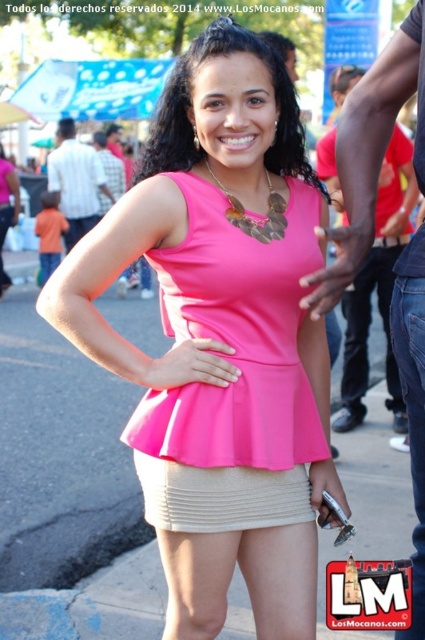
Question: Is pink matte peplum top at center closer to camera compared to beige ribbed miniskirt at center?

Choices:
 (A) yes
 (B) no

Answer: (A)

Question: Estimate the real-world distances between objects in this image. Which object is farther from the beige ribbed miniskirt at center?

Choices:
 (A) pink matte top at center
 (B) pink matte peplum top at center

Answer: (B)

Question: Does pink matte top at center lie in front of pink matte peplum top at center?

Choices:
 (A) no
 (B) yes

Answer: (B)

Question: Which object is closer to the camera taking this photo?

Choices:
 (A) beige ribbed miniskirt at center
 (B) pink matte top at center
 (C) pink matte peplum top at center

Answer: (B)

Question: Considering the real-world distances, which object is farthest from the pink matte top at center?

Choices:
 (A) pink matte peplum top at center
 (B) beige ribbed miniskirt at center

Answer: (B)

Question: Can you confirm if pink matte top at center is wider than beige ribbed miniskirt at center?

Choices:
 (A) no
 (B) yes

Answer: (B)